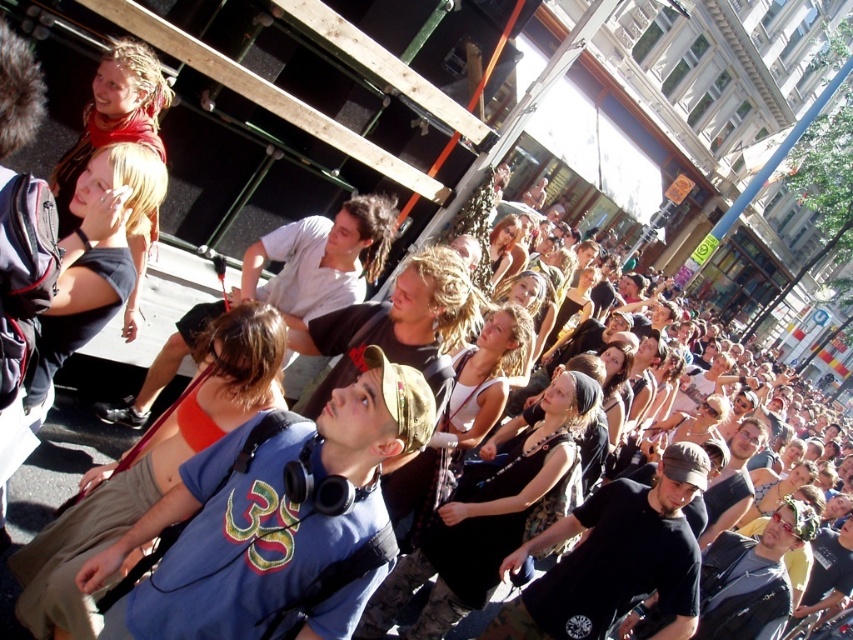
Question: Does blue fabric shirt at center have a greater width compared to matte white shirt at center?

Choices:
 (A) no
 (B) yes

Answer: (B)

Question: Which of the following is the closest to the observer?

Choices:
 (A) blue fabric shirt at center
 (B) matte white shirt at center
 (C) black matte t-shirt at center

Answer: (A)

Question: Does black matte t-shirt at center lie behind matte white shirt at center?

Choices:
 (A) no
 (B) yes

Answer: (A)

Question: Estimate the real-world distances between objects in this image. Which object is farther from the blue fabric shirt at center?

Choices:
 (A) matte white shirt at center
 (B) black matte t-shirt at center

Answer: (B)

Question: Is blue fabric shirt at center below black matte t-shirt at center?

Choices:
 (A) yes
 (B) no

Answer: (B)

Question: Which object is the farthest from the black matte t-shirt at center?

Choices:
 (A) matte white shirt at center
 (B) blue fabric shirt at center

Answer: (A)